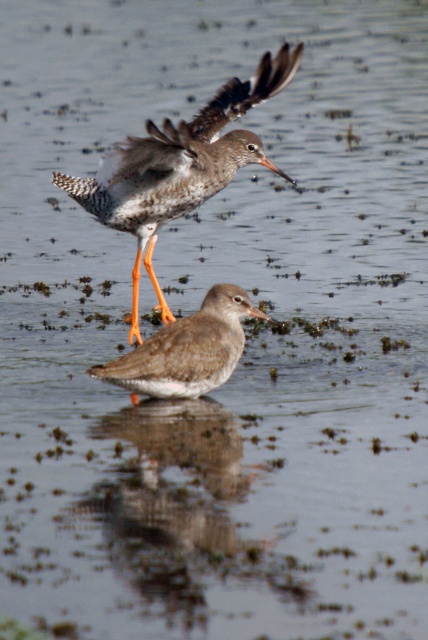
You are a birdwatcher trying to identify the birds in the image. Which bird is bigger between the speckled feathered bird at upper center and the brown speckled sandpiper at center?

The speckled feathered bird at upper center is larger in size than the brown speckled sandpiper at center.

You are a wildlife photographer aiming to capture both birds in a single shot. Given that your camera has a 100mm lens with a field of view that can capture objects up to 20 inches apart, will you be able to include both the speckled feathered bird at upper center and the brown speckled sandpiper at center in your photograph?

The speckled feathered bird at upper center is 21.70 inches from the brown speckled sandpiper at center. Since the distance between them exceeds the camera lens field of view limit of 20 inches, you cannot capture both birds in a single shot with the current lens.

You are standing at the edge of the wetland and want to observe the birds without disturbing them. If you move forward 2 meters, will you reach the point at coordinates point [238,163]?

The distance of point [238,163] from viewer is 3.73 meters. Moving forward 2 meters would bring you to 1.73 meters away from the point, so yes, you will reach the point at coordinates point [238,163].